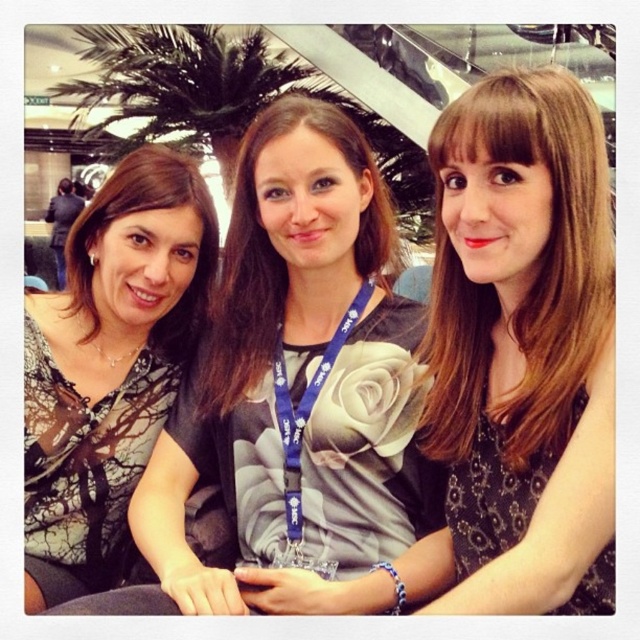
Question: Can you confirm if smooth black dress at center is smaller than matte gray dress at center?

Choices:
 (A) no
 (B) yes

Answer: (A)

Question: From the image, what is the correct spatial relationship of matte gray dress at center in relation to blue fabric lanyard at center?

Choices:
 (A) right
 (B) left

Answer: (B)

Question: Which object is closer to the camera taking this photo?

Choices:
 (A) matte black dress at center
 (B) blue fabric lanyard at center

Answer: (A)

Question: Estimate the real-world distances between objects in this image. Which object is farther from the matte gray dress at center?

Choices:
 (A) blue fabric lanyard at center
 (B) smooth black dress at center
 (C) matte black shirt at left

Answer: (B)

Question: Is matte black shirt at left in front of matte gray dress at center?

Choices:
 (A) no
 (B) yes

Answer: (B)

Question: Which point is closer to the camera?

Choices:
 (A) smooth black dress at center
 (B) matte black dress at center
 (C) matte black shirt at left
 (D) blue fabric lanyard at center

Answer: (A)